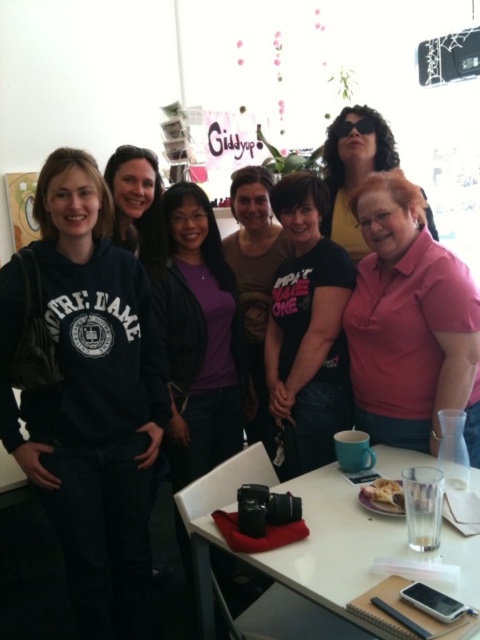
You are a photographer trying to adjust the lighting for a group photo. You notice the dark blue sweatshirt at left and the matte black hoodie at center. Which clothing item is closer to the camera based on their positions?

The dark blue sweatshirt at left is closer to the camera because it is in front of the matte black hoodie at center.

You are a photographer trying to adjust the lighting for a group photo. You notice two items in the scene that might cast shadows. Which of the two items, the dark blue sweatshirt at left or the matte black hoodie at center, would likely cast a larger shadow if the light source is positioned directly above them?

The dark blue sweatshirt at left is larger in size than the matte black hoodie at center, so it would cast a larger shadow when the light source is positioned directly above them.

You are a photographer trying to position a small decorative item on the table in the image. The item must be placed exactly at the point with coordinates point (313, 538). Where should you place it relative to the white glossy table at lower center?

The point (313, 538) is on the white glossy table at lower center, so you should place the item directly on the white glossy table at lower center.